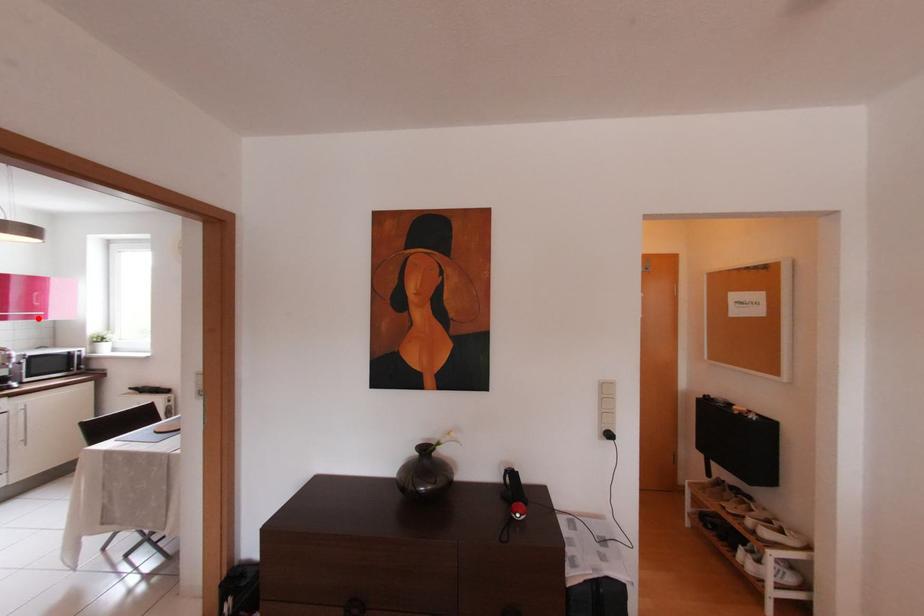
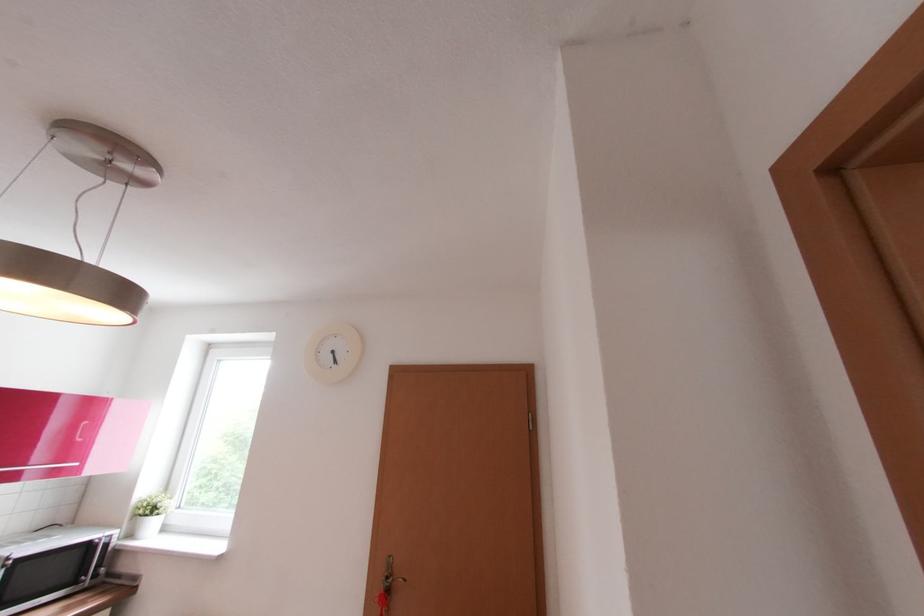
Question: I am providing you with two images of the same scene from different viewpoints. A red point is marked on the first image. At the location where the point appears in image 1, is it still visible in image 2?

Choices:
 (A) Yes
 (B) No

Answer: (A)